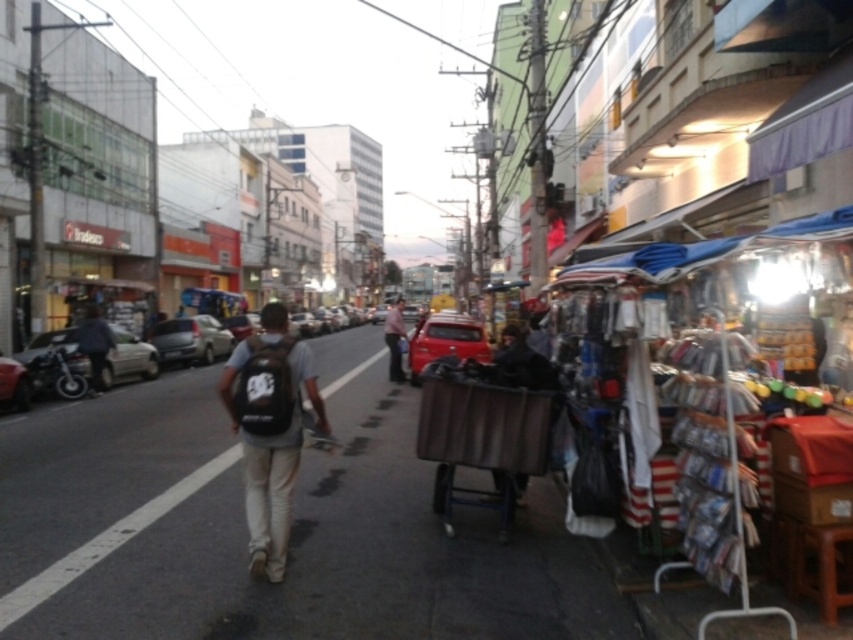
Question: Which point is closer to the camera taking this photo?

Choices:
 (A) (265, 438)
 (B) (444, 380)

Answer: (A)

Question: Does brown fabric cart at right appear under light brown leather jacket at center?

Choices:
 (A) yes
 (B) no

Answer: (A)

Question: Is black matte backpack at center wider than brown fabric cart at right?

Choices:
 (A) no
 (B) yes

Answer: (B)

Question: Which point is closer to the camera?

Choices:
 (A) black matte backpack at center
 (B) brown fabric cart at right

Answer: (A)

Question: Which object is positioned farthest from the light brown leather jacket at center?

Choices:
 (A) brown fabric cart at right
 (B) black matte backpack at center

Answer: (B)

Question: Is black matte backpack at center wider than brown fabric cart at right?

Choices:
 (A) no
 (B) yes

Answer: (B)